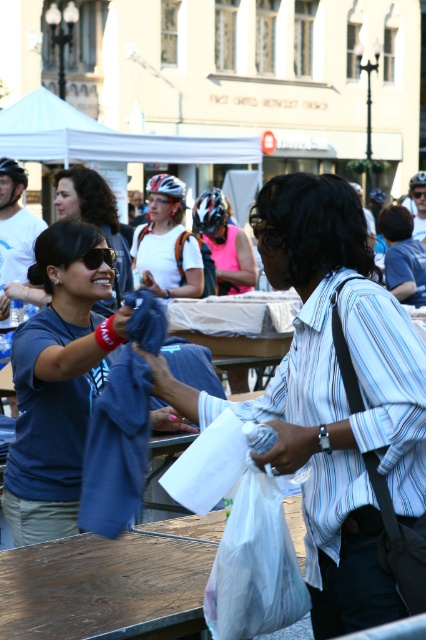
Question: Which object is positioned farthest from the pink fabric at center?

Choices:
 (A) matte blue t-shirt at center
 (B) black plastic sunglasses at upper left

Answer: (B)

Question: Is matte blue t-shirt at center further to camera compared to pink fabric at center?

Choices:
 (A) no
 (B) yes

Answer: (A)

Question: Which point is closer to the camera?

Choices:
 (A) (198, 209)
 (B) (135, 250)

Answer: (B)

Question: Does matte blue t-shirt at center have a greater width compared to pink fabric at center?

Choices:
 (A) no
 (B) yes

Answer: (A)

Question: Is pink fabric at center positioned at the back of black plastic sunglasses at upper left?

Choices:
 (A) yes
 (B) no

Answer: (A)

Question: Among these points, which one is farthest from the camera?

Choices:
 (A) (57, 474)
 (B) (227, 244)
 (C) (100, 253)
 (D) (146, 275)

Answer: (B)